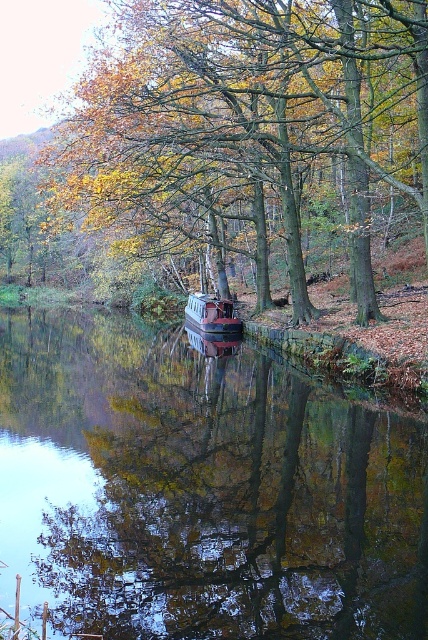
Question: Does golden wood tree at center appear on the left side of matte red boat at center?

Choices:
 (A) yes
 (B) no

Answer: (A)

Question: Which of these objects is positioned farthest from the smooth reflective water at center?

Choices:
 (A) matte red boat at center
 (B) golden wood tree at center

Answer: (A)

Question: Does golden wood tree at center appear over matte red boat at center?

Choices:
 (A) yes
 (B) no

Answer: (A)

Question: Which of the following is the closest to the observer?

Choices:
 (A) smooth reflective water at center
 (B) golden wood tree at center
 (C) matte red boat at center

Answer: (A)

Question: Which object is the closest to the smooth reflective water at center?

Choices:
 (A) matte red boat at center
 (B) golden wood tree at center

Answer: (B)

Question: Can you confirm if smooth reflective water at center is thinner than matte red boat at center?

Choices:
 (A) no
 (B) yes

Answer: (A)